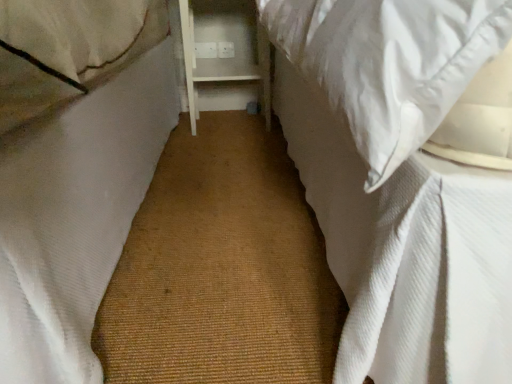
Locate an element on the screen. The width and height of the screenshot is (512, 384). free space in front of white wood shelf at center is located at coordinates (222, 144).